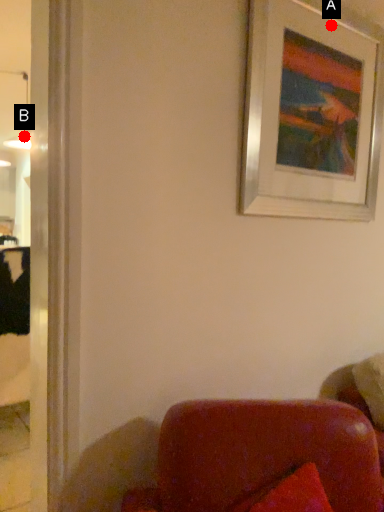
Question: Two points are circled on the image, labeled by A and B beside each circle. Which point is farther to the camera?

Choices:
 (A) A is further
 (B) B is further

Answer: (B)